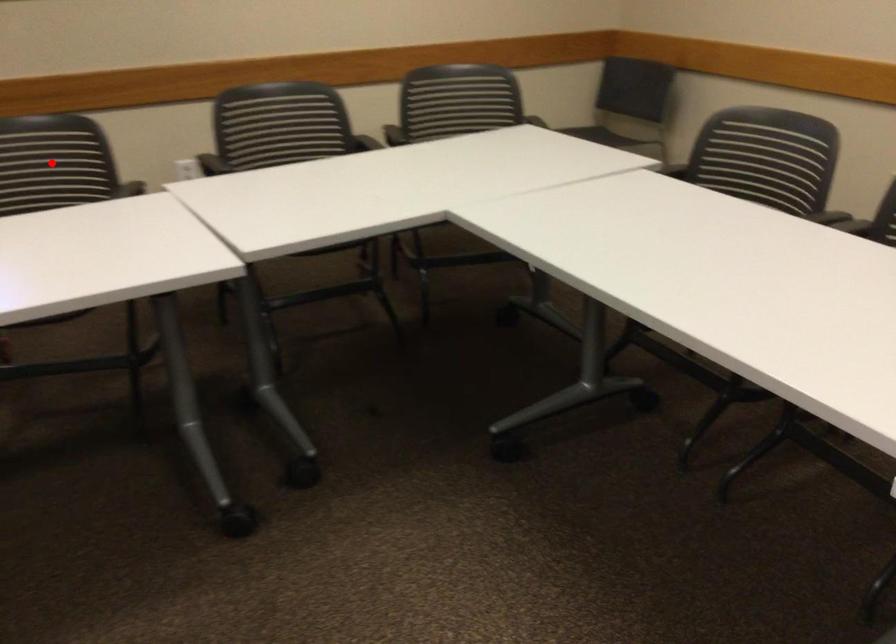
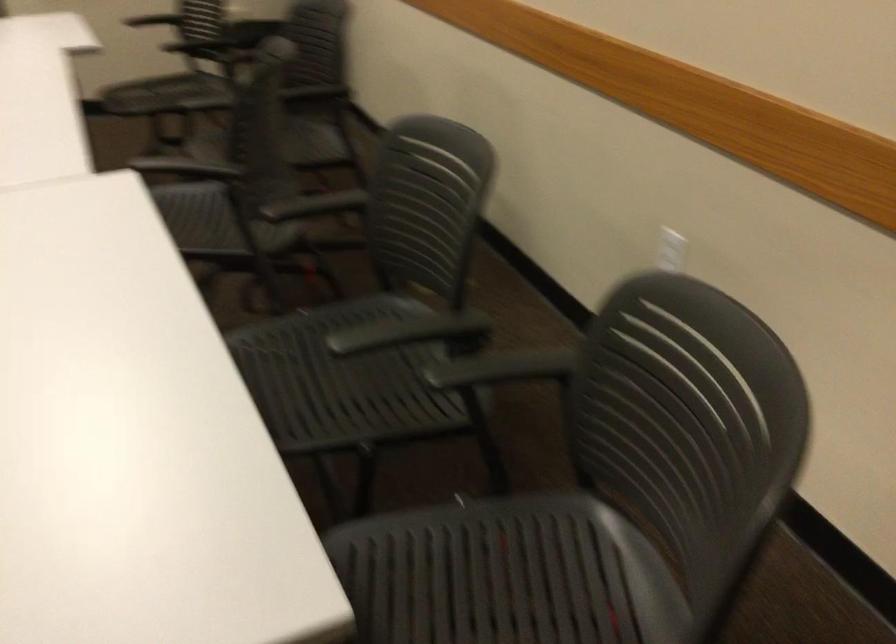
Question: I am providing you with two images of the same scene from different viewpoints. A red point is marked on the first image. At the location where the point appears in image 1, is it still visible in image 2?

Choices:
 (A) Yes
 (B) No

Answer: (B)